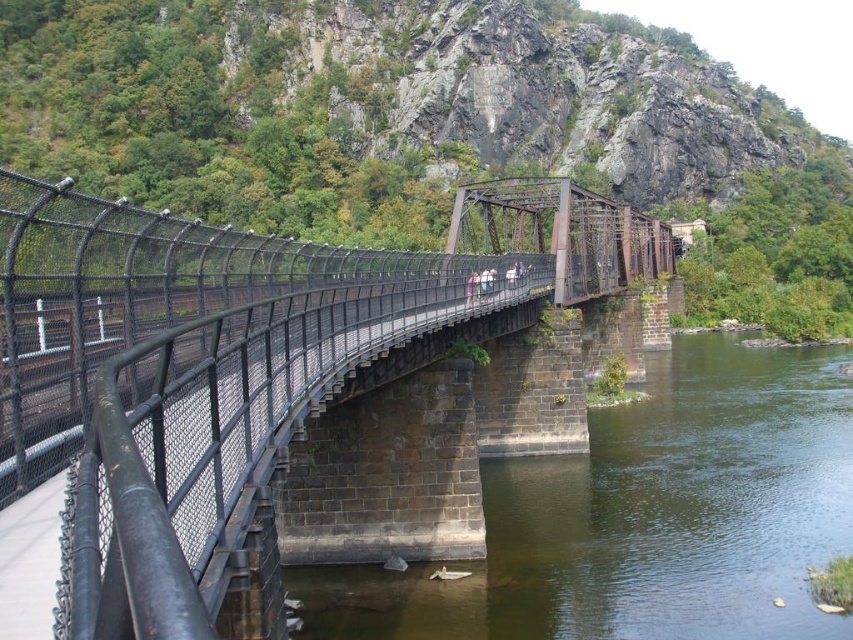
Who is more distant from viewer, (x=167, y=509) or (x=556, y=456)?

The point (x=556, y=456) is behind.

Where is `black metal fence at center`? Image resolution: width=853 pixels, height=640 pixels. black metal fence at center is located at coordinates (241, 364).